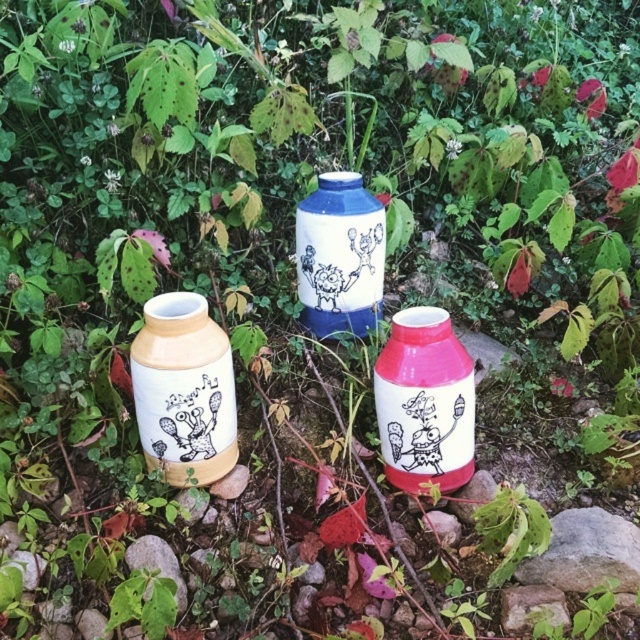
You are a delivery person who needs to place a matte yellow vase at left in a specific location. The coordinates given are point (182, 390). Based on the scene, can you confirm if this point is within the area where the matte yellow vase at left should be placed?

The coordinates point (182, 390) indicate the location of the matte yellow vase at left, so yes, the point is correct.

You are a delivery person who needs to place a small package between the matte yellow vase at left and the blue glazed vase at center. The package is 16 inches long. Can the package fit between them without overlapping either vase?

The distance between the matte yellow vase at left and the blue glazed vase at center is 15.52 inches. Since the package is 16 inches long, it is slightly longer than the available space. Therefore, the package cannot fit between them without overlapping either vase.

You are standing 1.5 meters away from the camera position. You want to pick up the matte ceramic bottle at center without moving your feet. Is it within your reach?

The matte ceramic bottle at center is 1.24 meters from the camera. Since you are standing 1.5 meters away from the camera position, the total distance between you and the bottle is 1.24 meters. Assuming an average arm reach of about 1 meter, you would not be able to reach it without moving your feet.